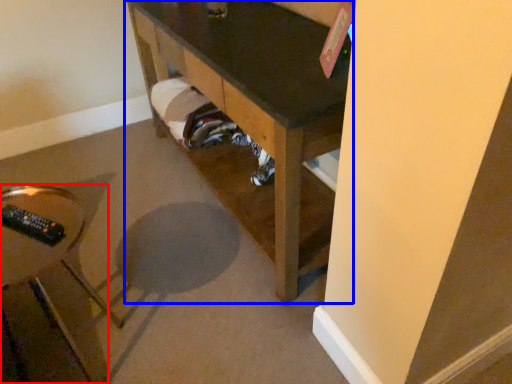
Question: Which object is further to the camera taking this photo, furniture (highlighted by a red box) or furniture (highlighted by a blue box)?

Choices:
 (A) furniture
 (B) furniture

Answer: (B)